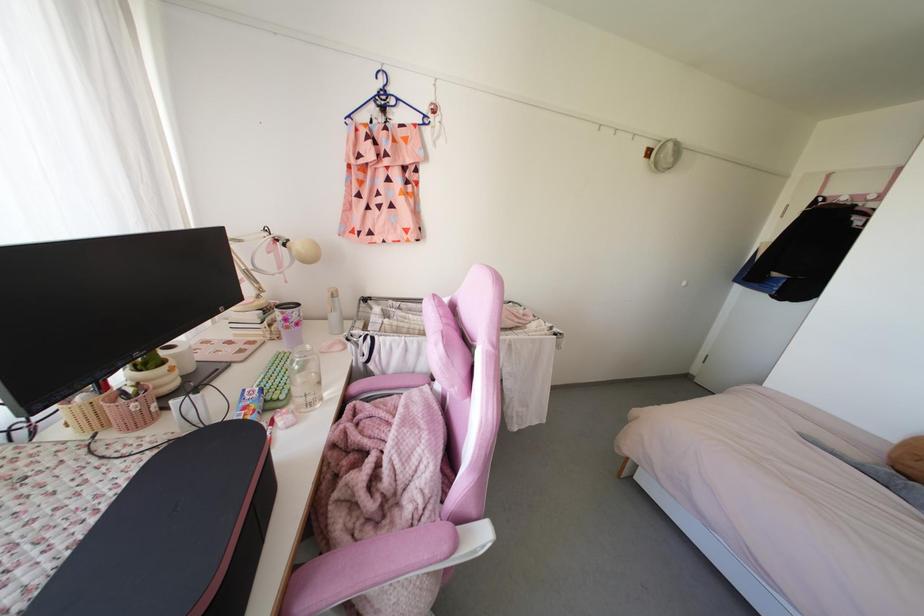
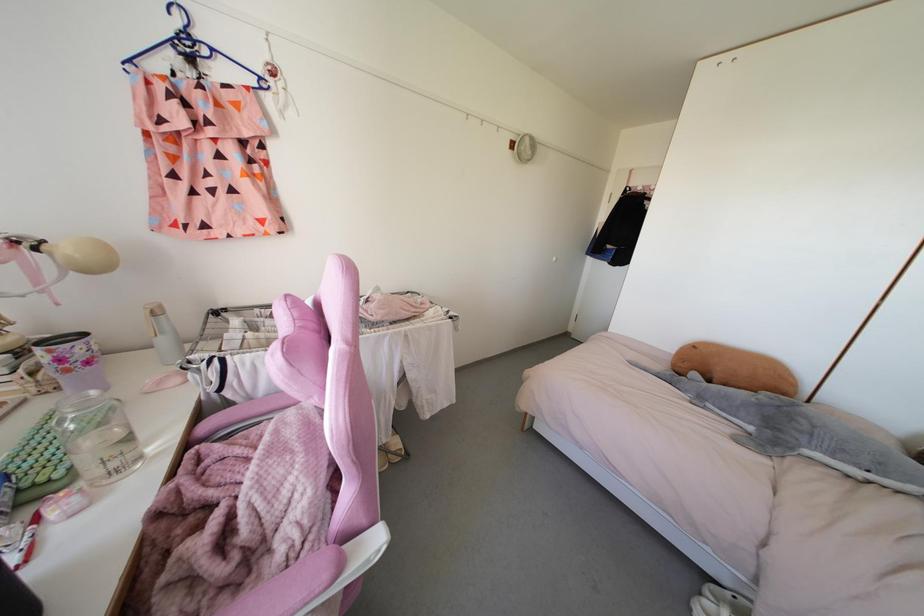
Where in the second image is the point corresponding to point (307, 346) from the first image?

(92, 392)